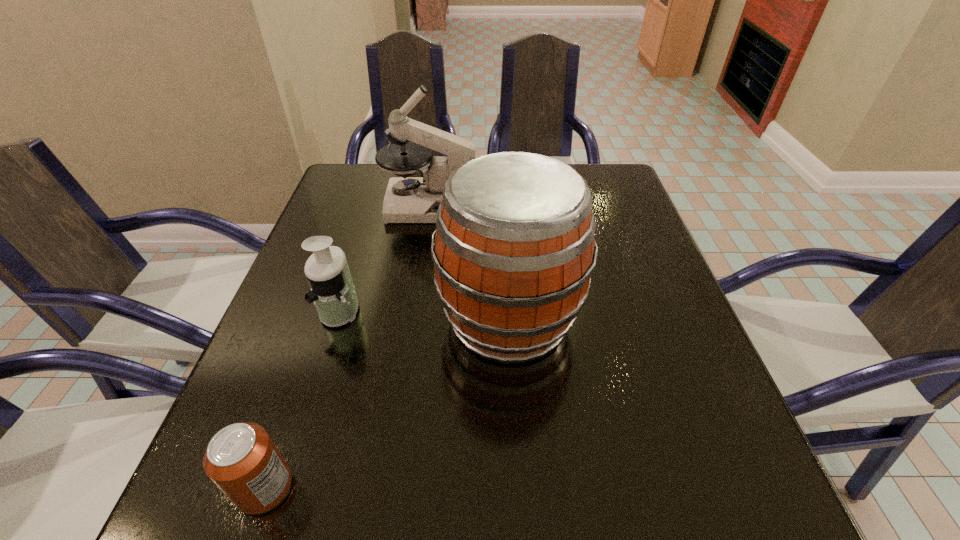
Identify the location of free point between the second shortest object and the nearest object. (302, 399).

Where is `unoccupied position between the cider and the can`? unoccupied position between the cider and the can is located at coordinates (387, 403).

In order to click on unoccupied position between the juicer and the microscope in this screenshot , I will do `click(386, 257)`.

The image size is (960, 540). What are the coordinates of `free space between the cider and the third tallest object` in the screenshot? It's located at (424, 314).

Locate an element on the screen. The image size is (960, 540). empty space between the shortest object and the farthest object is located at coordinates (348, 346).

The image size is (960, 540). Identify the location of free space between the nearest object and the cider. (387, 403).

At what (x,y) coordinates should I click in order to perform the action: click on free space between the cider and the juicer. Please return your answer as a coordinate pair (x, y). The image size is (960, 540). Looking at the image, I should click on (424, 314).

Image resolution: width=960 pixels, height=540 pixels. I want to click on unoccupied area between the nearest object and the microscope, so click(348, 346).

Point out which object is positioned as the third nearest to the microscope. Please provide its 2D coordinates. Your answer should be formatted as a tuple, i.e. [(x, y)], where the tuple contains the x and y coordinates of a point satisfying the conditions above.

[(241, 459)]

Where is `object that is the closest one to the second shortest object`? The width and height of the screenshot is (960, 540). object that is the closest one to the second shortest object is located at coordinates (514, 250).